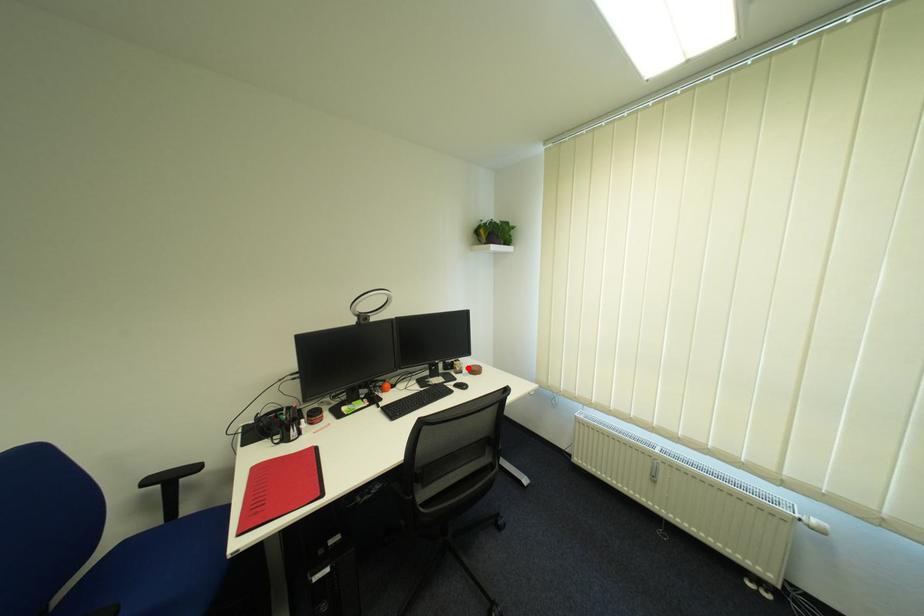
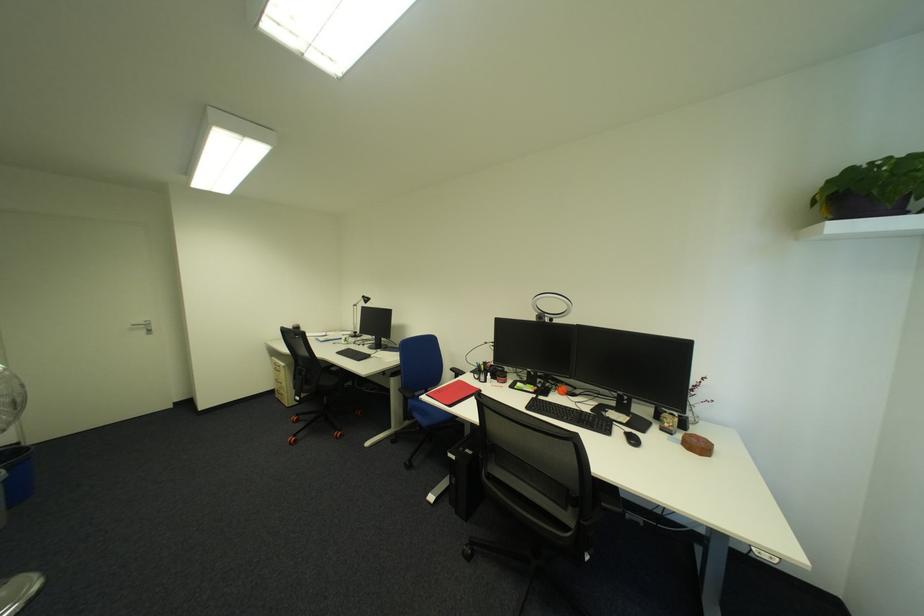
Question: I am providing you with two images of the same scene from different viewpoints. Image1 has a red point marked. In image2, the corresponding 3D location appears at what relative position? Reply with the corresponding letter.

Choices:
 (A) Closer
 (B) Farther

Answer: (A)